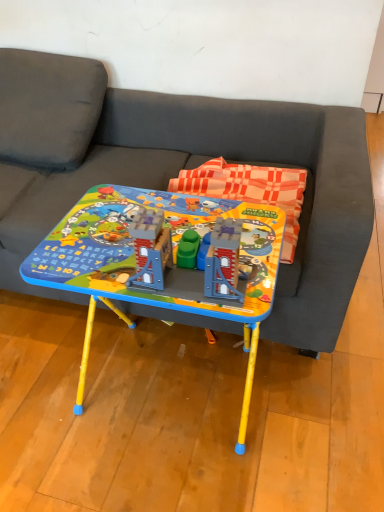
Question: Is matte plastic table at center positioned in front of dark gray fabric couch at center?

Choices:
 (A) yes
 (B) no

Answer: (A)

Question: Is matte plastic table at center at the right side of dark gray fabric couch at center?

Choices:
 (A) no
 (B) yes

Answer: (B)

Question: Is matte plastic table at center oriented away from dark gray fabric couch at center?

Choices:
 (A) yes
 (B) no

Answer: (A)

Question: Are matte plastic table at center and dark gray fabric couch at center beside each other?

Choices:
 (A) yes
 (B) no

Answer: (B)

Question: Can you confirm if matte plastic table at center is thinner than dark gray fabric couch at center?

Choices:
 (A) no
 (B) yes

Answer: (B)

Question: Considering the relative sizes of matte plastic table at center and dark gray fabric couch at center in the image provided, is matte plastic table at center taller than dark gray fabric couch at center?

Choices:
 (A) no
 (B) yes

Answer: (A)

Question: Is dark gray fabric couch at center turned away from matte plastic table at center?

Choices:
 (A) no
 (B) yes

Answer: (B)

Question: Is dark gray fabric couch at center further to the viewer compared to matte plastic table at center?

Choices:
 (A) no
 (B) yes

Answer: (B)

Question: From a real-world perspective, is dark gray fabric couch at center located beneath matte plastic table at center?

Choices:
 (A) no
 (B) yes

Answer: (A)

Question: Does dark gray fabric couch at center have a greater height compared to matte plastic table at center?

Choices:
 (A) no
 (B) yes

Answer: (B)

Question: Can you confirm if dark gray fabric couch at center is smaller than matte plastic table at center?

Choices:
 (A) no
 (B) yes

Answer: (A)

Question: Considering the relative positions of dark gray fabric couch at center and matte plastic table at center in the image provided, is dark gray fabric couch at center in front of matte plastic table at center?

Choices:
 (A) yes
 (B) no

Answer: (B)

Question: Does point (216, 205) appear closer or farther from the camera than point (132, 94)?

Choices:
 (A) farther
 (B) closer

Answer: (B)